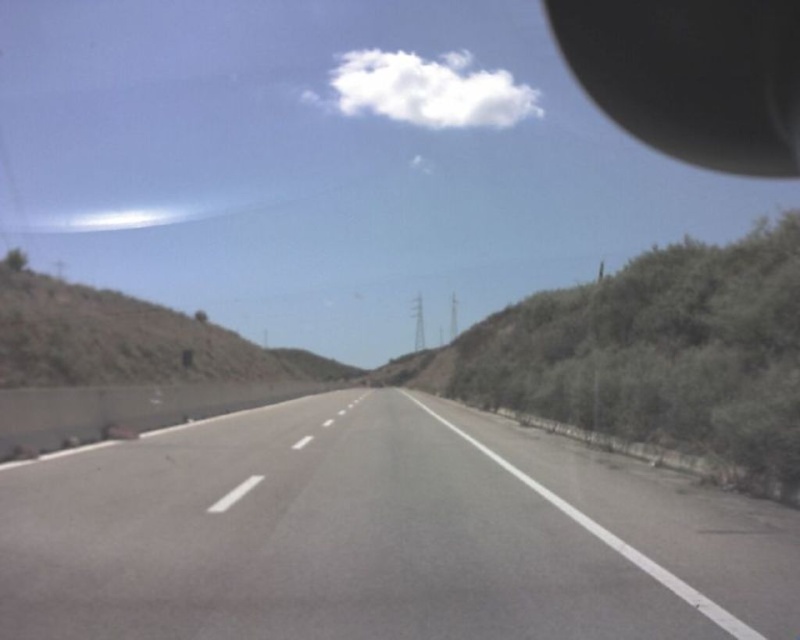
You are driving a car and need to check the distance between the gray asphalt highway at center and the black rubber view mirror at upper right. Which object is nearer to your current position?

The gray asphalt highway at center is closer to the viewer than the black rubber view mirror at upper right, so the highway is nearer to your current position.

You are standing on the side of the road and want to cross the gray asphalt highway at center. The safe distance to cross the road is 15 feet. Can you safely cross the road without needing to adjust your path?

The distance between you and the gray asphalt highway at center is 15.84 feet, which is slightly more than the 15 feet safe distance. Therefore, you can safely cross the road without needing to adjust your path.

You are a drone operator who needs to deliver a package to a specific point on the highway. The package must be dropped precisely at point [380,536]. According to the image, what is the exact location of this point?

The point [380,536] is located at the gray asphalt highway at center.